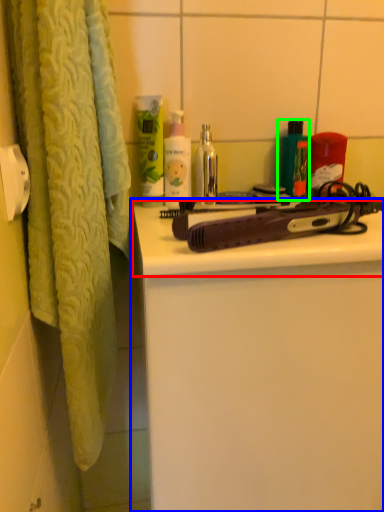
Question: Which is farther away from counter top (highlighted by a red box)? bathroom cabinet (highlighted by a blue box) or product (highlighted by a green box)?

Choices:
 (A) bathroom cabinet
 (B) product

Answer: (B)